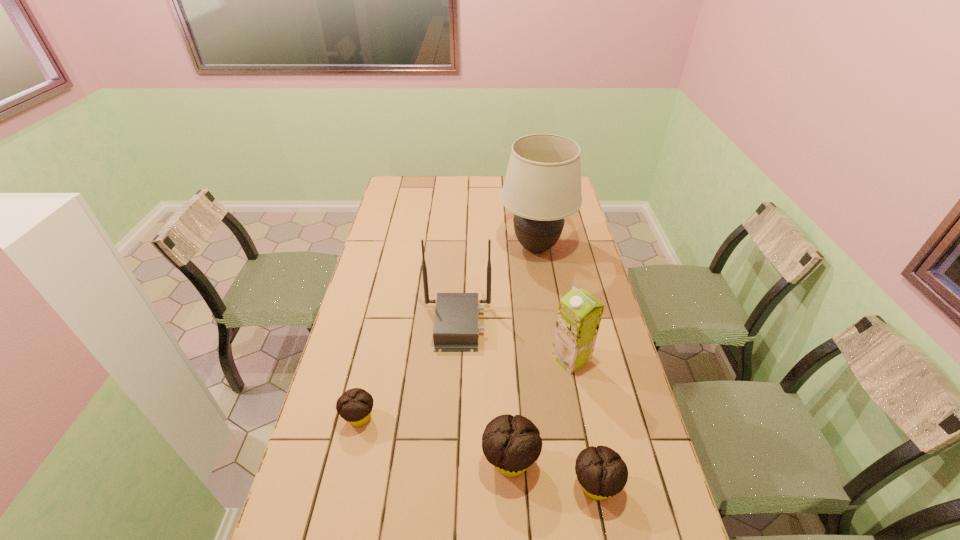
The width and height of the screenshot is (960, 540). Identify the location of vacant point located on the right of the shortest object. (419, 417).

Where is `blank area located on the back of the second muffin from right to left`? The image size is (960, 540). blank area located on the back of the second muffin from right to left is located at coordinates (504, 339).

The image size is (960, 540). I want to click on free space located 0.320m on the left of the rightmost muffin, so click(444, 485).

What are the coordinates of `free space located 0.370m on the back of the router to connect cables` in the screenshot? It's located at (598, 324).

Identify the location of vacant region located 0.340m on the front of the farthest object. This screenshot has width=960, height=540. (550, 338).

Find the location of `vacant space positioned 0.380m on the left of the soya milk`. vacant space positioned 0.380m on the left of the soya milk is located at coordinates (433, 359).

Image resolution: width=960 pixels, height=540 pixels. I want to click on object present at the left edge, so click(x=355, y=406).

This screenshot has height=540, width=960. I want to click on muffin that is at the right edge, so click(602, 473).

Where is `lampshade that is positioned at the right edge`? lampshade that is positioned at the right edge is located at coordinates (542, 186).

Where is `soya milk that is at the right edge`? The height and width of the screenshot is (540, 960). soya milk that is at the right edge is located at coordinates (579, 315).